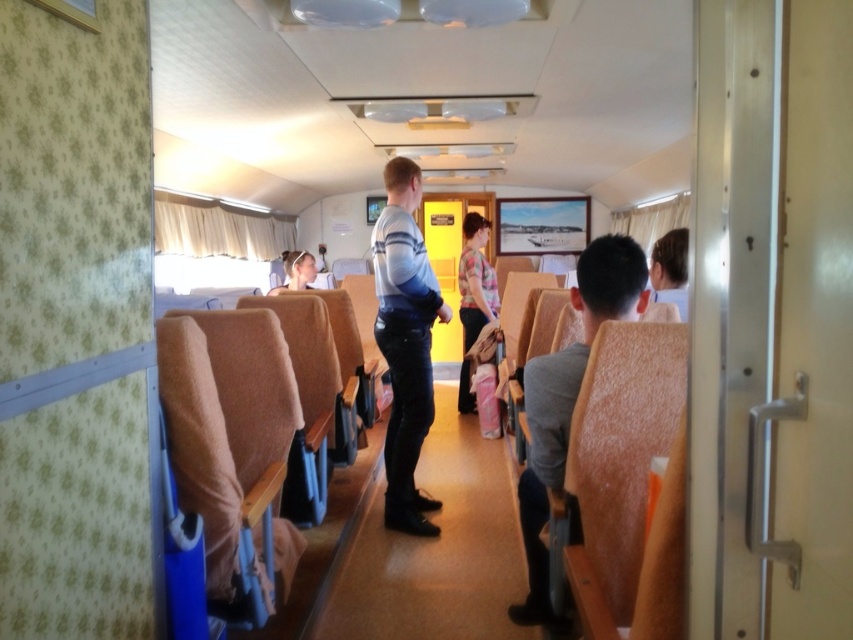
Question: Which of these objects is positioned farthest from the floral shirt at center?

Choices:
 (A) gray fabric jacket at center
 (B) brown fabric seat at center

Answer: (A)

Question: Estimate the real-world distances between objects in this image. Which object is closer to the floral shirt at center?

Choices:
 (A) brown fabric seat at center
 (B) gray fabric jacket at center
 (C) matte blue jeans at center

Answer: (A)

Question: Can you confirm if brown fabric seat at center is bigger than floral shirt at center?

Choices:
 (A) no
 (B) yes

Answer: (B)

Question: Which point appears closest to the camera in this image?

Choices:
 (A) (467, 316)
 (B) (529, 538)
 (C) (480, 592)

Answer: (B)

Question: Does gray fabric jacket at center appear on the left side of floral shirt at center?

Choices:
 (A) no
 (B) yes

Answer: (A)

Question: Is brown fabric seat at center above floral shirt at center?

Choices:
 (A) no
 (B) yes

Answer: (A)